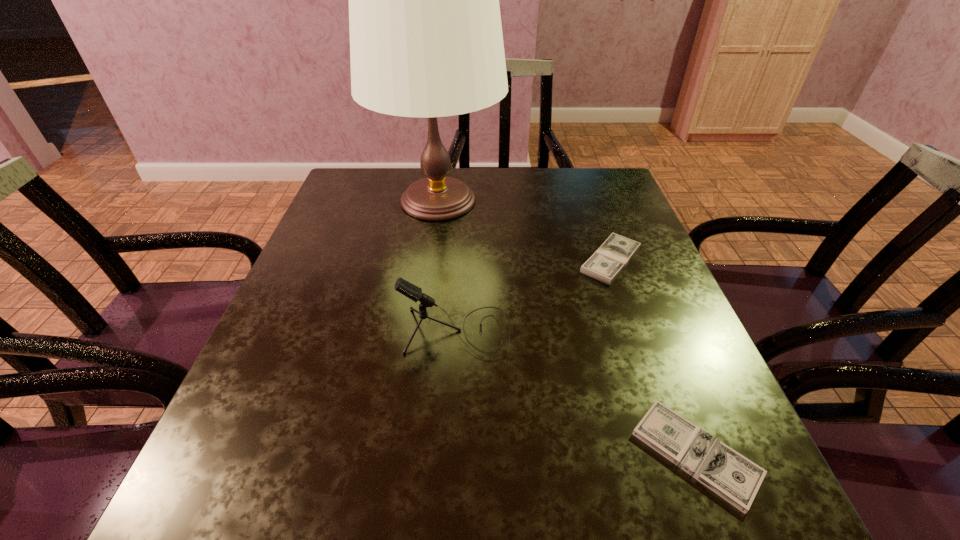
Where is `the tallest object`? the tallest object is located at coordinates (426, 40).

I want to click on the second nearest object, so click(406, 288).

The image size is (960, 540). What are the coordinates of `the second tallest object` in the screenshot? It's located at (406, 288).

Find the location of `the third tallest object`. the third tallest object is located at coordinates pyautogui.click(x=608, y=261).

Identify the location of the taller dollar. (608, 261).

The image size is (960, 540). Identify the location of the nearer dollar. (735, 478).

The width and height of the screenshot is (960, 540). What are the coordinates of `the shorter dollar` in the screenshot? It's located at (735, 478).

Locate an element on the screen. This screenshot has height=540, width=960. free point located 0.150m on the right of the lamp is located at coordinates (559, 201).

Find the location of a particular element. The height and width of the screenshot is (540, 960). vacant position located 0.260m on the stand of the second nearest object is located at coordinates (645, 333).

Where is `vacant space located 0.120m on the left of the second shortest object`? vacant space located 0.120m on the left of the second shortest object is located at coordinates (524, 261).